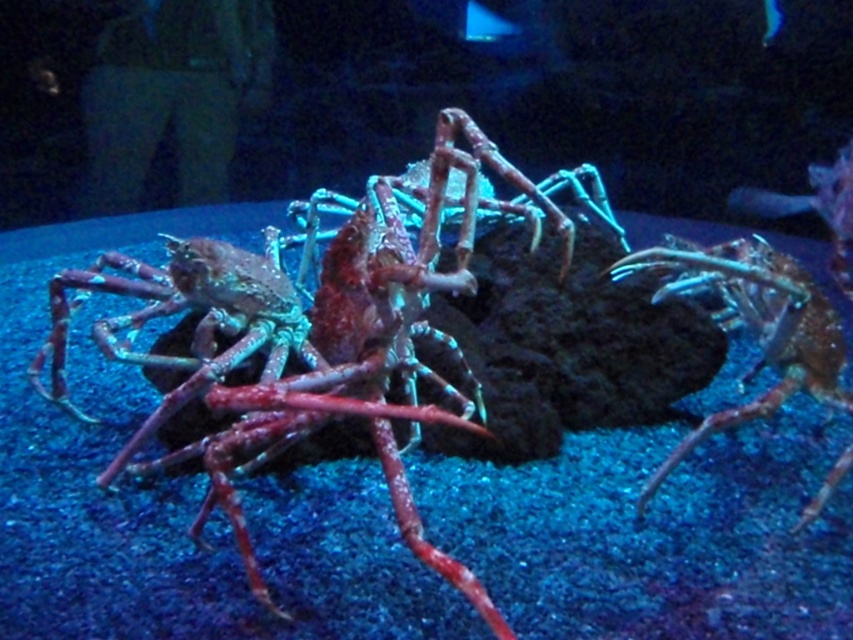
Question: Can you confirm if shiny red crab at center is bigger than shiny metallic crab claw at center?

Choices:
 (A) yes
 (B) no

Answer: (A)

Question: Which point is closer to the camera?

Choices:
 (A) shiny red crab at center
 (B) shiny metallic crab claw at center

Answer: (A)

Question: Observing the image, what is the correct spatial positioning of shiny red crab at center in reference to shiny metallic crab claw at center?

Choices:
 (A) below
 (B) above

Answer: (B)

Question: Can you confirm if shiny red crab at center is positioned below shiny metallic crab claw at center?

Choices:
 (A) yes
 (B) no

Answer: (B)

Question: Among these objects, which one is farthest from the camera?

Choices:
 (A) shiny metallic crab claw at center
 (B) shiny red crab at center

Answer: (A)